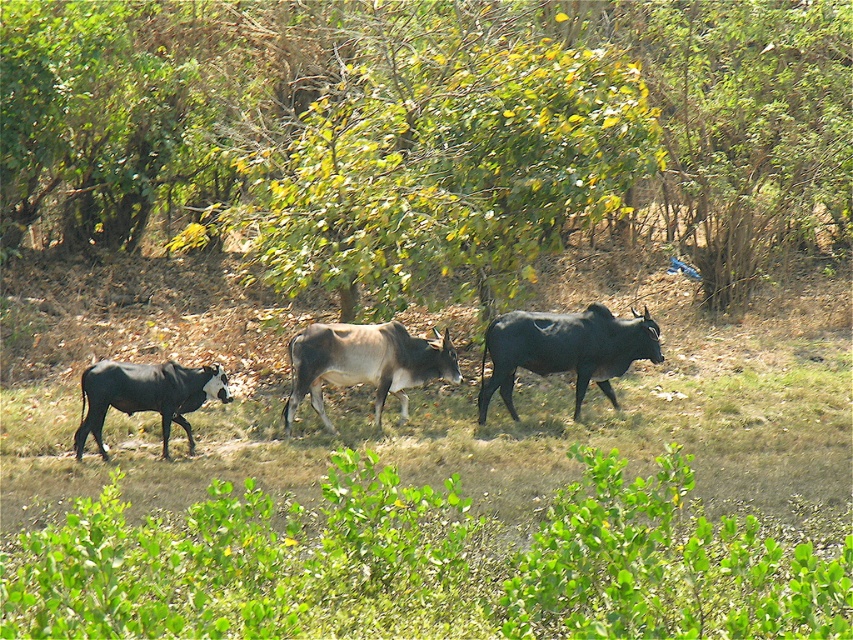
Question: Can you confirm if green leafy grass at lower center is positioned below black glossy bull at center?

Choices:
 (A) yes
 (B) no

Answer: (A)

Question: Among these objects, which one is farthest from the camera?

Choices:
 (A) brown glossy cow at center
 (B) shiny black cow at center
 (C) green leafy grass at lower center
 (D) black glossy cow at left

Answer: (B)

Question: Estimate the real-world distances between objects in this image. Which object is farther from the brown glossy cow at center?

Choices:
 (A) black glossy cow at left
 (B) black glossy bull at center
 (C) green leafy tree at center
 (D) shiny black cow at center

Answer: (C)

Question: Can you confirm if brown glossy cow at center is positioned below black glossy cow at left?

Choices:
 (A) no
 (B) yes

Answer: (A)

Question: Is black glossy bull at center positioned in front of brown glossy cow at center?

Choices:
 (A) no
 (B) yes

Answer: (A)

Question: Among these points, which one is farthest from the camera?

Choices:
 (A) (643, 515)
 (B) (639, 339)
 (C) (361, 337)
 (D) (99, 381)

Answer: (B)